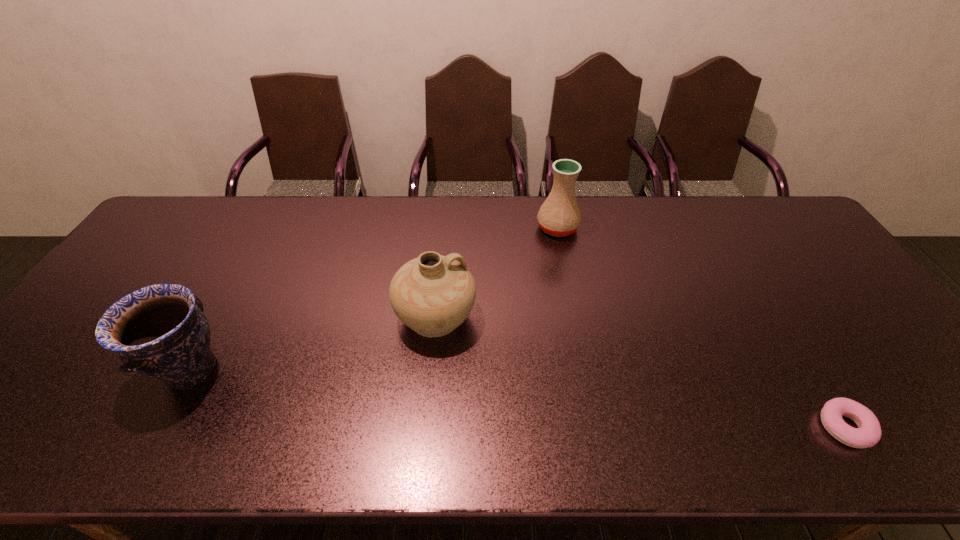
Locate an element on the screen. The width and height of the screenshot is (960, 540). the second object from right to left is located at coordinates (559, 215).

Where is `the rightmost pottery`? the rightmost pottery is located at coordinates (559, 215).

Find the location of a particular element. The width and height of the screenshot is (960, 540). the third object from right to left is located at coordinates (432, 294).

This screenshot has width=960, height=540. Identify the location of the leftmost object. (160, 330).

Find the location of a particular element. The height and width of the screenshot is (540, 960). the rightmost object is located at coordinates (868, 433).

At what (x,y) coordinates should I click in order to perform the action: click on the shortest object. Please return your answer as a coordinate pair (x, y). Looking at the image, I should click on (868, 433).

Locate an element on the screen. The image size is (960, 540). vacant region located 0.230m on the right of the farthest pottery is located at coordinates click(648, 228).

Find the location of `vacant point located on the left of the second pottery from right to left`. vacant point located on the left of the second pottery from right to left is located at coordinates (292, 317).

Locate an element on the screen. The height and width of the screenshot is (540, 960). free space located on the front handle of the leftmost pottery is located at coordinates 324,370.

This screenshot has width=960, height=540. Find the location of `free spot located 0.170m on the right of the rightmost object`. free spot located 0.170m on the right of the rightmost object is located at coordinates (948, 427).